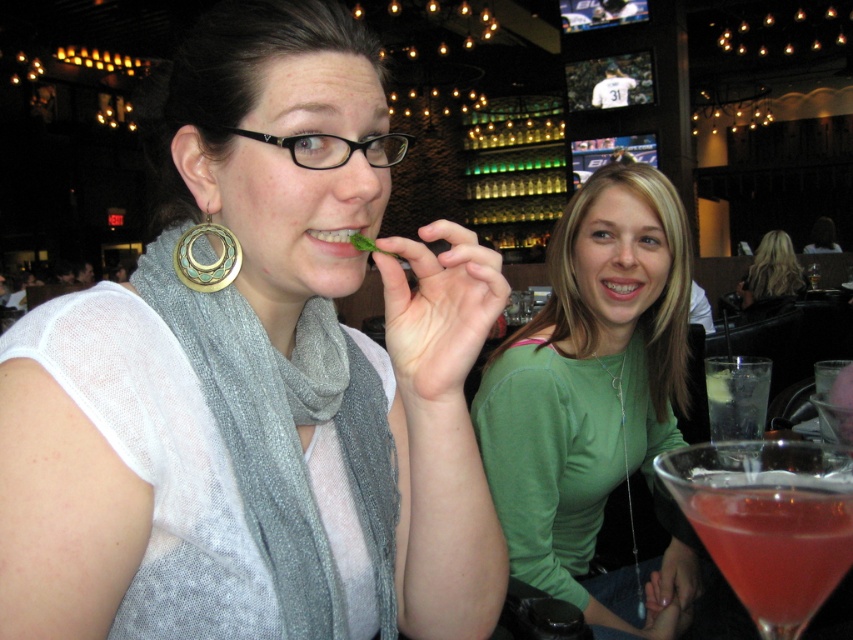
How far apart are green matte shirt at center and black plastic glasses at upper center?

green matte shirt at center is 22.69 inches away from black plastic glasses at upper center.

Does point (532, 561) lie behind point (227, 129)?

Yes, point (532, 561) is farther from viewer.

The height and width of the screenshot is (640, 853). I want to click on green matte shirt at center, so click(x=595, y=404).

Is pink translucent cocktail at lower right shorter than clear glass martini at right?

Correct, pink translucent cocktail at lower right is not as tall as clear glass martini at right.

Which is above, pink translucent cocktail at lower right or clear glass martini at right?

pink translucent cocktail at lower right is higher up.

Does point (790, 449) come closer to viewer compared to point (733, 436)?

Yes, it is in front of point (733, 436).

I want to click on pink translucent cocktail at lower right, so click(769, 522).

Can you confirm if matte silver scarf at center is positioned to the left of gray knitted scarf at center?

Yes, matte silver scarf at center is to the left of gray knitted scarf at center.

Does point (277, 573) come closer to viewer compared to point (260, 452)?

Yes, it is.

What do you see at coordinates (254, 384) in the screenshot?
I see `matte silver scarf at center` at bounding box center [254, 384].

Where is `matte silver scarf at center`? This screenshot has width=853, height=640. matte silver scarf at center is located at coordinates (254, 384).